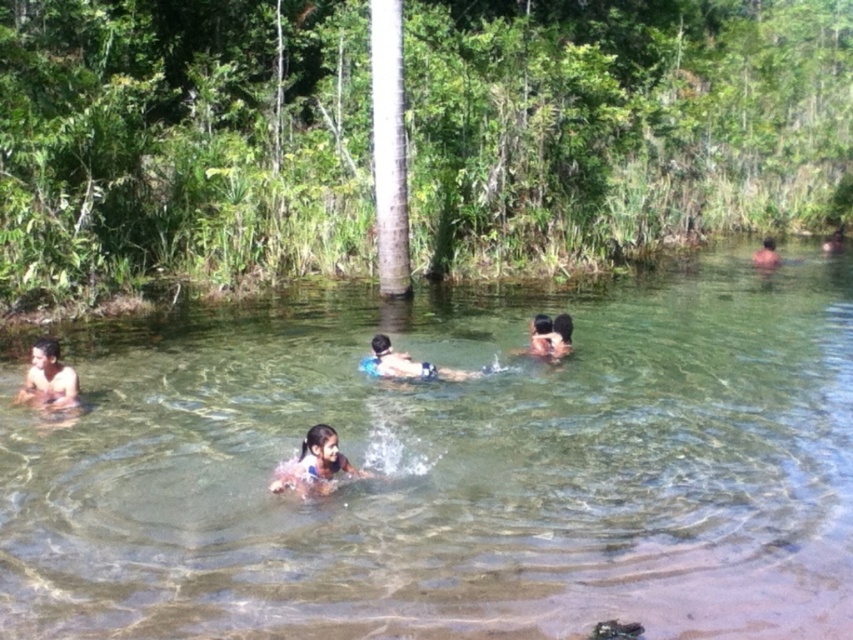
Describe the element at coordinates (451, 468) in the screenshot. I see `clear water at center` at that location.

Between clear water at center and light brown skin at lower left, which one appears on the right side from the viewer's perspective?

From the viewer's perspective, clear water at center appears more on the right side.

Identify the location of clear water at center. (451, 468).

Between point (326, 451) and point (42, 376), which one is positioned behind?

The point (42, 376) is behind.

Which is more to the right, brown skin at center or light brown skin at lower left?

brown skin at center

Where is `brown skin at center`? This screenshot has height=640, width=853. brown skin at center is located at coordinates (314, 465).

Does brown skin at center appear under brown skin at upper right?

Indeed, brown skin at center is positioned under brown skin at upper right.

Measure the distance between brown skin at center and camera.

The distance of brown skin at center from camera is 24.96 feet.

At what (x,y) coordinates should I click in order to perform the action: click on brown skin at center. Please return your answer as a coordinate pair (x, y). Looking at the image, I should click on (314, 465).

I want to click on brown skin at center, so click(x=314, y=465).